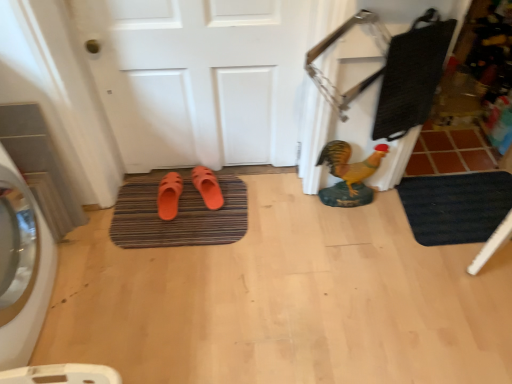
Where is `blank space above brown textured bath mat at center, the 2th bath mat from the right (from a real-world perspective)`? The image size is (512, 384). blank space above brown textured bath mat at center, the 2th bath mat from the right (from a real-world perspective) is located at coordinates (179, 210).